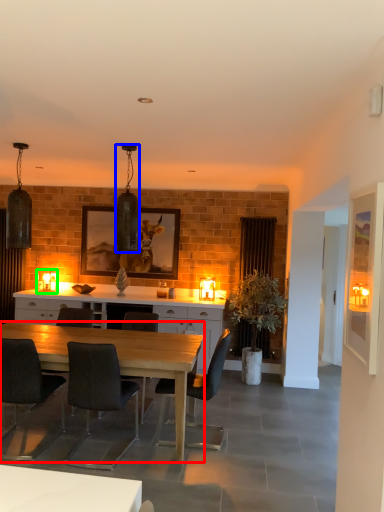
Question: Estimate the real-world distances between objects in this image. Which object is farther from desk (highlighted by a red box), lamp (highlighted by a blue box) or lamp (highlighted by a green box)?

Choices:
 (A) lamp
 (B) lamp

Answer: (B)